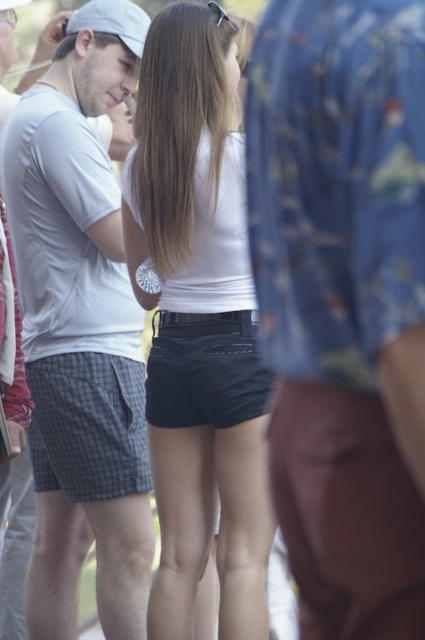
You are taking a photo of two people standing in front of you. You notice two points marked on your camera screen at coordinates point (207,83) and point (136,52). Which point is closer to your camera lens?

Point (207,83) is closer to the camera lens than point (136,52).

You are a photographer trying to capture a candid shot of the black matte shorts at center and the white matte baseball cap at upper left. Since you want to ensure both objects are in focus, which object should you prioritize focusing on first based on their sizes in the frame?

The black matte shorts at center has a greater height compared to the white matte baseball cap at upper left, so you should prioritize focusing on the black matte shorts at center first because larger objects require more precise focus to ensure clarity.